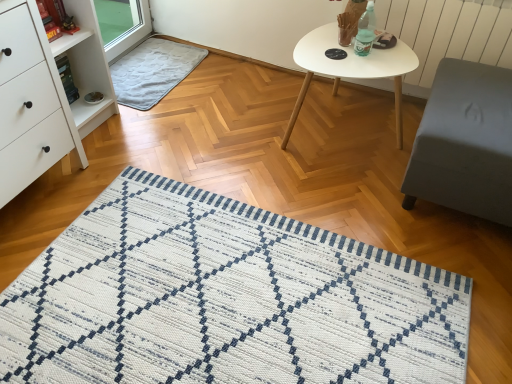
Question: Looking at the image, does gray matte ottoman at right seem bigger or smaller compared to white matte oval table at upper center?

Choices:
 (A) small
 (B) big

Answer: (B)

Question: Choose the correct answer: Is gray matte ottoman at right inside white matte oval table at upper center or outside it?

Choices:
 (A) inside
 (B) outside

Answer: (B)

Question: Considering the real-world distances, which object is closest to the white matte chest of drawers at left?

Choices:
 (A) gray soft rug at upper left
 (B) gray matte ottoman at right
 (C) translucent plastic bottle at upper right
 (D) white textured radiator at upper right
 (E) white matte oval table at upper center

Answer: (A)

Question: Which is farther from the gray soft rug at upper left?

Choices:
 (A) gray matte ottoman at right
 (B) white matte oval table at upper center
 (C) translucent plastic bottle at upper right
 (D) white textured radiator at upper right
 (E) white matte chest of drawers at left

Answer: (A)